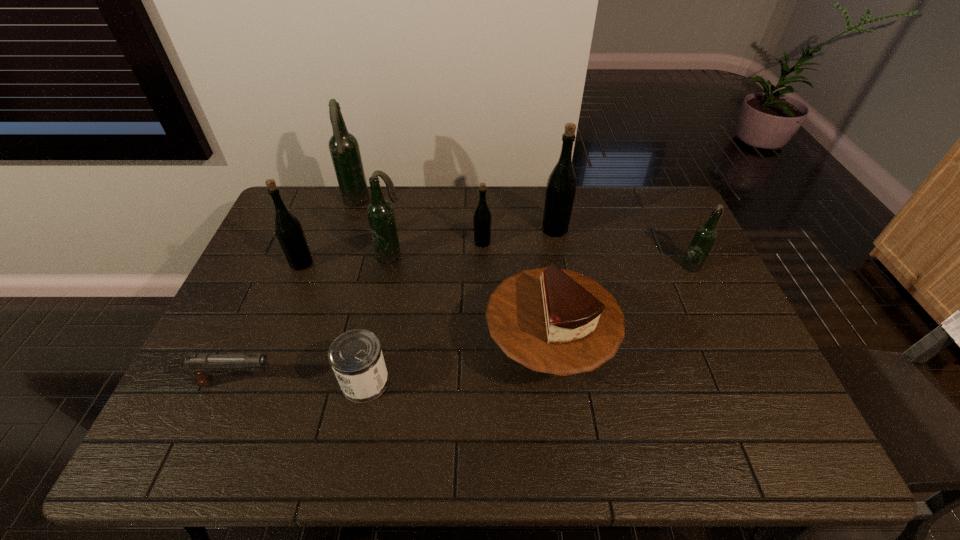
This screenshot has width=960, height=540. Identify the location of object that stands as the seventh closest to the biggest dark beer bottle. (202, 366).

The width and height of the screenshot is (960, 540). Find the location of `beer bottle that is the fifth closest one to the leftmost green beer bottle`. beer bottle that is the fifth closest one to the leftmost green beer bottle is located at coordinates (705, 236).

I want to click on beer bottle that is the fourth nearest to the smallest green beer bottle, so coord(288,229).

Find the location of a particular element. The image size is (960, 540). dark beer bottle that stands as the second closest to the rightmost beer bottle is located at coordinates (343, 146).

Choose which dark beer bottle is the second nearest neighbor to the rightmost dark beer bottle. Please provide its 2D coordinates. Your answer should be formatted as a tuple, i.e. [(x, y)], where the tuple contains the x and y coordinates of a point satisfying the conditions above.

[(343, 146)]

Identify which green beer bottle is the third nearest to the third beer bottle from left to right. Please provide its 2D coordinates. Your answer should be formatted as a tuple, i.e. [(x, y)], where the tuple contains the x and y coordinates of a point satisfying the conditions above.

[(560, 189)]

Find the location of a particular element. green beer bottle that stands as the closest to the gun is located at coordinates (288, 229).

At what (x,y) coordinates should I click in order to perform the action: click on free space that satisfies the following two spatial constraints: 1. on the front side of the farthest beer bottle; 2. on the left side of the second green beer bottle from left to right. Please return your answer as a coordinate pair (x, y). The image size is (960, 540). Looking at the image, I should click on (342, 242).

Find the location of a particular element. free space that satisfies the following two spatial constraints: 1. on the back side of the second dark beer bottle from right to left; 2. on the left side of the rightmost green beer bottle is located at coordinates (396, 230).

At what (x,y) coordinates should I click in order to perform the action: click on free space that satisfies the following two spatial constraints: 1. on the front side of the second smallest dark beer bottle; 2. on the left side of the rightmost beer bottle. Please return your answer as a coordinate pair (x, y). The image size is (960, 540). Looking at the image, I should click on (389, 265).